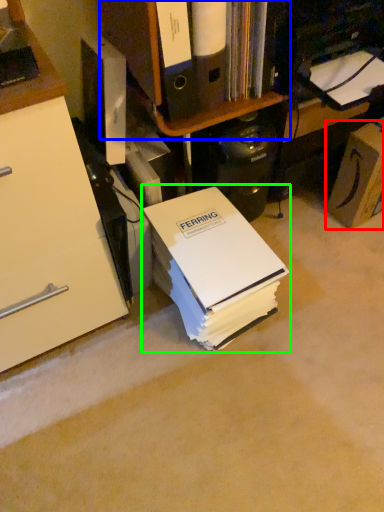
Question: Which object is positioned closest to cardboard box (highlighted by a red box)? Select from shelf (highlighted by a blue box) and paperback book (highlighted by a green box).

Choices:
 (A) shelf
 (B) paperback book

Answer: (A)